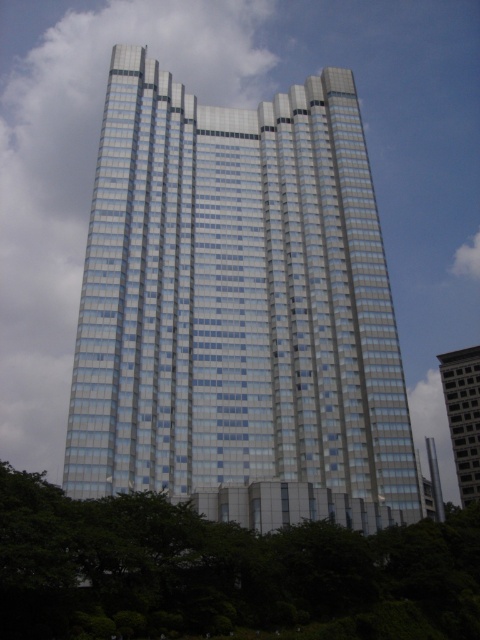
Does green leafy tree at lower center appear under glassy reflective building at right?

No.

Between green leafy tree at lower center and glassy reflective building at right, which one is positioned lower?

glassy reflective building at right is lower down.

Between point (309, 577) and point (460, 424), which one is positioned behind?

The point (460, 424) is behind.

Image resolution: width=480 pixels, height=640 pixels. Find the location of `green leafy tree at lower center`. green leafy tree at lower center is located at coordinates (223, 572).

Who is higher up, glassy steel tower at center or glassy reflective building at right?

glassy steel tower at center

Who is positioned more to the left, glassy steel tower at center or glassy reflective building at right?

glassy steel tower at center

Does point (216, 278) come farther from viewer compared to point (465, 433)?

No.

The image size is (480, 640). In order to click on glassy steel tower at center in this screenshot , I will do `click(239, 310)`.

Is point (130, 476) positioned before point (233, 563)?

No.

Find the location of `glassy steel tower at center`. glassy steel tower at center is located at coordinates tap(239, 310).

Find the location of a particular element. glassy steel tower at center is located at coordinates (239, 310).

The height and width of the screenshot is (640, 480). I want to click on glassy steel tower at center, so click(x=239, y=310).